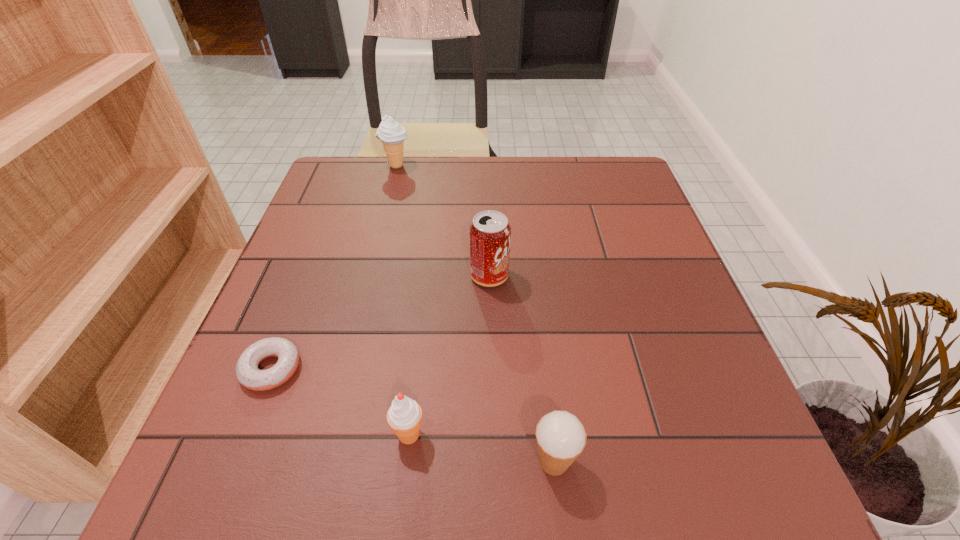
Where is `vacant region at the far left corner`? This screenshot has width=960, height=540. vacant region at the far left corner is located at coordinates (331, 193).

I want to click on vacant point at the far right corner, so coord(590,164).

You are a GUI agent. You are given a task and a screenshot of the screen. Output one action in this format:
    pyautogui.click(x=<x>, y=<y>)
    Task: Click on the free space between the second farthest object and the second icecream from left to right
    Image resolution: width=960 pixels, height=540 pixels.
    Given the screenshot: What is the action you would take?
    pyautogui.click(x=449, y=355)

Where is `free space between the rightmost icecream and the third object from right to left`? free space between the rightmost icecream and the third object from right to left is located at coordinates (481, 448).

The height and width of the screenshot is (540, 960). I want to click on unoccupied area between the second object from right to left and the rightmost icecream, so click(x=521, y=369).

You are a GUI agent. You are given a task and a screenshot of the screen. Output one action in this format:
    pyautogui.click(x=<x>, y=<y>)
    Task: Click on the free point between the second object from right to left and the doughnut
    The width and height of the screenshot is (960, 540).
    Given the screenshot: What is the action you would take?
    pyautogui.click(x=380, y=322)

The height and width of the screenshot is (540, 960). What are the coordinates of `vacant area that lies between the fourth nearest object and the fourth object from right to left` in the screenshot? It's located at (443, 221).

The image size is (960, 540). In order to click on vacant space that is in between the third object from left to right and the rightmost object in this screenshot , I will do `click(481, 448)`.

The width and height of the screenshot is (960, 540). In order to click on vacant area that lies between the second object from right to left and the second icecream from right to left in this screenshot , I will do `click(449, 355)`.

Where is `unoccupied area between the third object from left to right and the fourth object from left to right`? The height and width of the screenshot is (540, 960). unoccupied area between the third object from left to right and the fourth object from left to right is located at coordinates (449, 355).